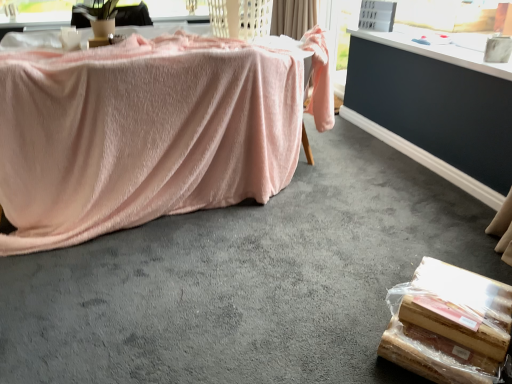
Question: Is dark gray carpet at lower right positioned with its back to wooden board at lower right?

Choices:
 (A) no
 (B) yes

Answer: (A)

Question: Does dark gray carpet at lower right have a greater height compared to wooden board at lower right?

Choices:
 (A) yes
 (B) no

Answer: (B)

Question: From the image's perspective, is dark gray carpet at lower right under wooden board at lower right?

Choices:
 (A) yes
 (B) no

Answer: (B)

Question: From a real-world perspective, is dark gray carpet at lower right located higher than wooden board at lower right?

Choices:
 (A) no
 (B) yes

Answer: (A)

Question: From the image's perspective, does dark gray carpet at lower right appear higher than wooden board at lower right?

Choices:
 (A) yes
 (B) no

Answer: (A)

Question: Considering the relative sizes of dark gray carpet at lower right and wooden board at lower right in the image provided, is dark gray carpet at lower right bigger than wooden board at lower right?

Choices:
 (A) no
 (B) yes

Answer: (A)

Question: Does pink fabric-covered object at left have a greater width compared to dark gray carpet at lower right?

Choices:
 (A) yes
 (B) no

Answer: (A)

Question: Is pink fabric-covered object at left beside dark gray carpet at lower right?

Choices:
 (A) yes
 (B) no

Answer: (B)

Question: Considering the relative positions of pink fabric-covered object at left and dark gray carpet at lower right in the image provided, is pink fabric-covered object at left to the left of dark gray carpet at lower right from the viewer's perspective?

Choices:
 (A) yes
 (B) no

Answer: (A)

Question: Is pink fabric-covered object at left further to camera compared to dark gray carpet at lower right?

Choices:
 (A) yes
 (B) no

Answer: (B)

Question: Is pink fabric-covered object at left outside of dark gray carpet at lower right?

Choices:
 (A) no
 (B) yes

Answer: (B)

Question: From a real-world perspective, is pink fabric-covered object at left located beneath dark gray carpet at lower right?

Choices:
 (A) yes
 (B) no

Answer: (A)

Question: Is dark gray carpet at lower right thinner than beige fabric curtain at upper center?

Choices:
 (A) no
 (B) yes

Answer: (B)